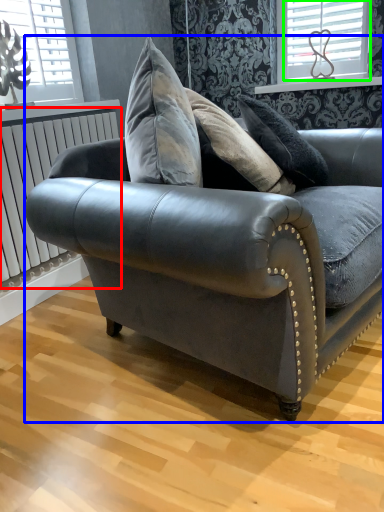
Question: Estimate the real-world distances between objects in this image. Which object is closer to radiator (highlighted by a red box), studio couch (highlighted by a blue box) or window (highlighted by a green box)?

Choices:
 (A) studio couch
 (B) window

Answer: (A)